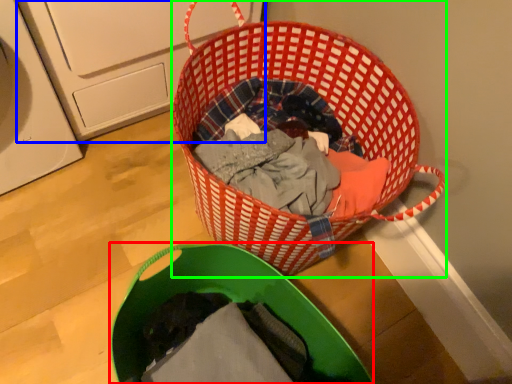
Question: Estimate the real-world distances between objects in this image. Which object is farther from laundry basket (highlighted by a red box), washing machine (highlighted by a blue box) or picnic basket (highlighted by a green box)?

Choices:
 (A) washing machine
 (B) picnic basket

Answer: (A)